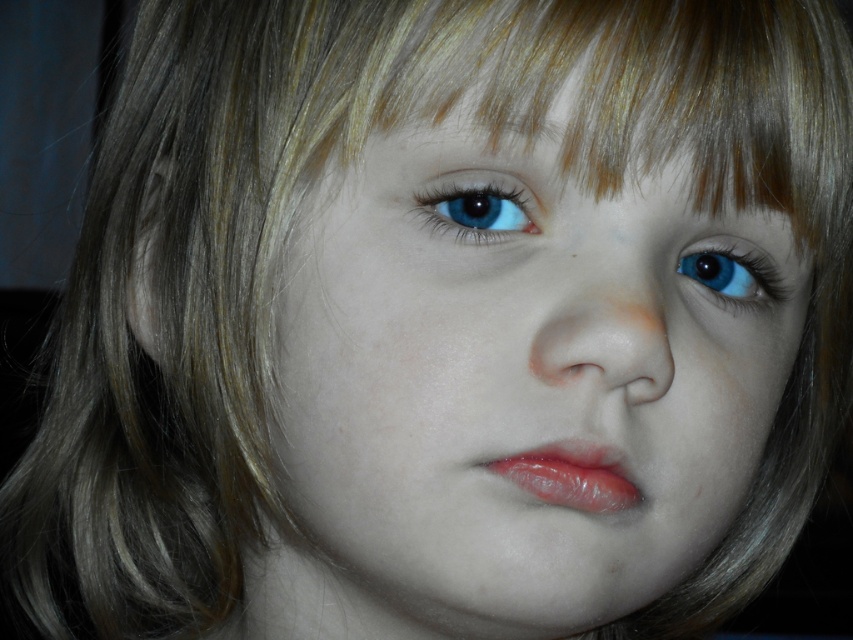
Looking at this image, is smooth skin face at center positioned behind glossy lips at center?

That is False.

Between smooth skin face at center and glossy lips at center, which one is positioned higher?

smooth skin face at center is higher up.

Does point (625, 454) lie in front of point (561, 497)?

No, (625, 454) is further to viewer.

Where is `smooth skin face at center`? The width and height of the screenshot is (853, 640). smooth skin face at center is located at coordinates (509, 392).

Which is above, shiny blonde hair at upper center or glossy lips at center?

shiny blonde hair at upper center is above.

Who is more distant from viewer, [821,22] or [573,493]?

The point [821,22] is behind.

Find the location of a particular element. shiny blonde hair at upper center is located at coordinates (488, 93).

The width and height of the screenshot is (853, 640). I want to click on shiny blonde hair at upper center, so click(x=488, y=93).

Who is more distant from viewer, (268,528) or (679,259)?

The point (268,528) is behind.

Does smooth skin face at center have a lesser height compared to blue glossy eye at center?

No, smooth skin face at center is not shorter than blue glossy eye at center.

Is point (693, 248) less distant than point (721, 276)?

Yes, point (693, 248) is in front of point (721, 276).

Find the location of a particular element. smooth skin face at center is located at coordinates (509, 392).